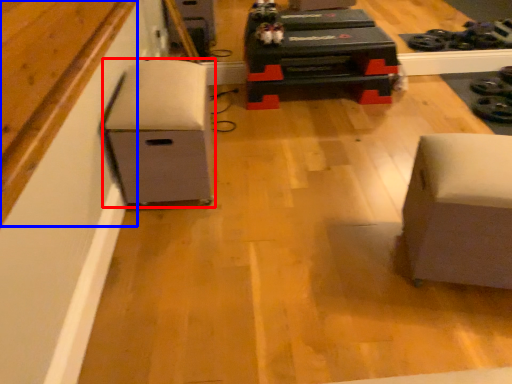
Question: Which object is closer to the camera taking this photo, furniture (highlighted by a red box) or wood (highlighted by a blue box)?

Choices:
 (A) furniture
 (B) wood

Answer: (B)